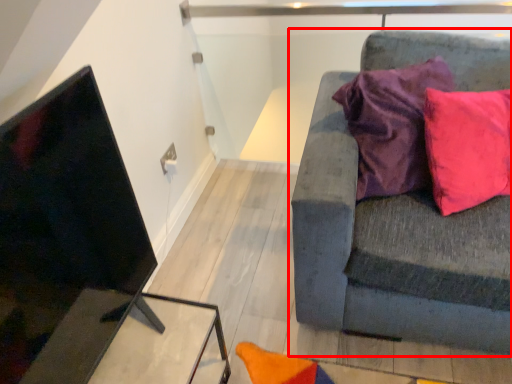
Question: Considering the relative positions of studio couch (annotated by the red box) and table in the image provided, where is studio couch (annotated by the red box) located with respect to the staircase?

Choices:
 (A) left
 (B) right

Answer: (B)